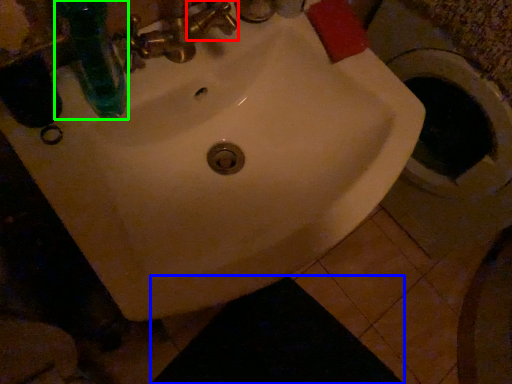
Question: Estimate the real-world distances between objects in this image. Which object is farther from plumbing fixture (highlighted by a red box), dark (highlighted by a blue box) or bottle (highlighted by a green box)?

Choices:
 (A) dark
 (B) bottle

Answer: (A)